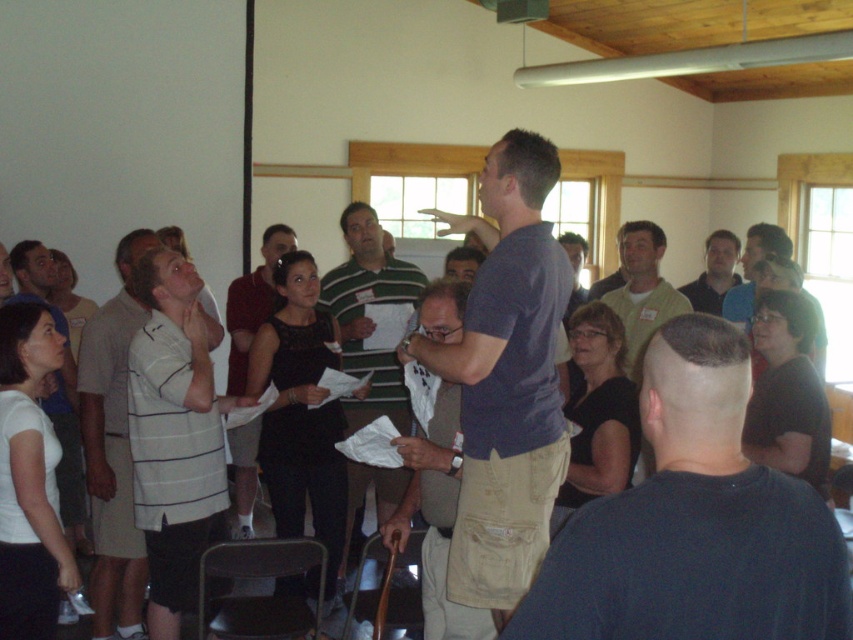
Does point (550, 552) come farther from viewer compared to point (674, 637)?

That is True.

Can you confirm if matte black shirt at center is positioned above dark blue t-shirt at center?

No.

Where is `matte black shirt at center`? Image resolution: width=853 pixels, height=640 pixels. matte black shirt at center is located at coordinates (694, 522).

Does matte black shirt at center appear over green striped shirt at center?

No, matte black shirt at center is not above green striped shirt at center.

Is matte black shirt at center closer to the viewer compared to green striped shirt at center?

Yes, matte black shirt at center is in front of green striped shirt at center.

This screenshot has height=640, width=853. In order to click on matte black shirt at center in this screenshot , I will do `click(694, 522)`.

Between matte khaki pants at center and matte green shirt at center, which one appears on the right side from the viewer's perspective?

matte green shirt at center

Between point (448, 396) and point (688, 292), which one is positioned in front?

Point (448, 396) is in front.

Identify the location of matte khaki pants at center. (436, 518).

You are a GUI agent. You are given a task and a screenshot of the screen. Output one action in this format:
    pyautogui.click(x=<x>, y=<y>)
    Task: Click on the matte khaki pants at center
    Image resolution: width=853 pixels, height=640 pixels.
    Given the screenshot: What is the action you would take?
    pyautogui.click(x=436, y=518)